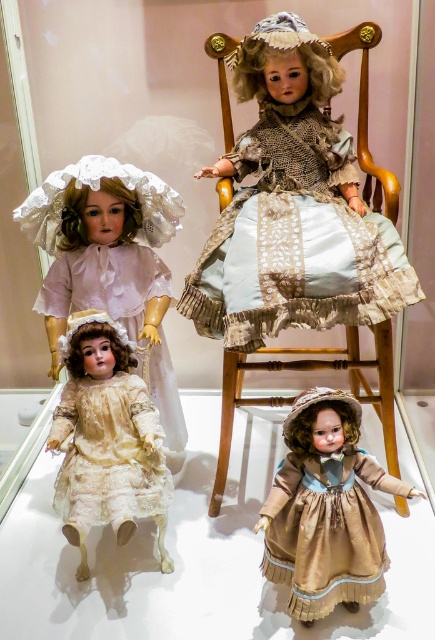
Question: Which of the following is the closest to the observer?

Choices:
 (A) lace fabric dress at lower left
 (B) wooden chair at center
 (C) satin gold dress at lower right

Answer: (C)

Question: Which object is the farthest from the transparent glass table at lower center?

Choices:
 (A) matte white lace doll at center
 (B) satin gold dress at lower right

Answer: (A)

Question: Among these objects, which one is farthest from the camera?

Choices:
 (A) wooden chair at center
 (B) transparent glass table at lower center
 (C) satin gold dress at lower right

Answer: (A)

Question: Considering the relative positions of light blue satin dress at center and matte white lace doll at center in the image provided, where is light blue satin dress at center located with respect to matte white lace doll at center?

Choices:
 (A) left
 (B) right

Answer: (B)

Question: Where is transparent glass table at lower center located in relation to light blue satin dress at center in the image?

Choices:
 (A) left
 (B) right

Answer: (A)

Question: Is matte white lace doll at center bigger than satin gold dress at lower right?

Choices:
 (A) yes
 (B) no

Answer: (A)